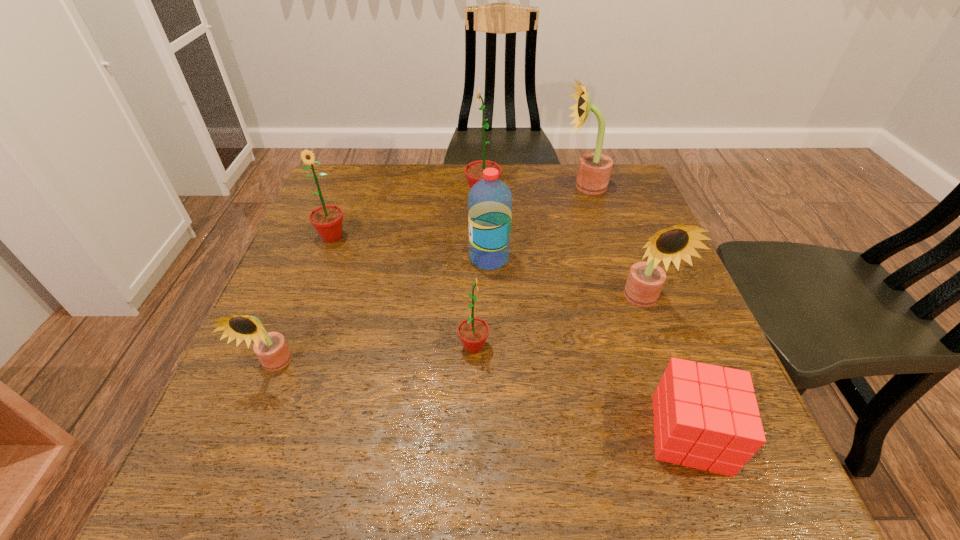
Locate an element on the screen. Image resolution: width=960 pixels, height=540 pixels. empty space that is in between the biggest green sunflower and the red cube is located at coordinates (587, 315).

I want to click on vacant space that is in between the shortest object and the red water bottle, so click(x=589, y=346).

In order to click on vacant region between the biggest yellow sunflower and the second biggest yellow sunflower in this screenshot , I will do `click(613, 244)`.

This screenshot has height=540, width=960. I want to click on vacant point located between the water bottle and the nearest object, so click(x=589, y=346).

Where is `vacant space in between the nearest yellow sunflower and the biggest green sunflower`? Image resolution: width=960 pixels, height=540 pixels. vacant space in between the nearest yellow sunflower and the biggest green sunflower is located at coordinates (379, 281).

Locate an element on the screen. The image size is (960, 540). free space between the water bottle and the smallest yellow sunflower is located at coordinates pyautogui.click(x=382, y=312).

Select which object appears as the sixth closest to the biggest yellow sunflower. Please provide its 2D coordinates. Your answer should be formatted as a tuple, i.e. [(x, y)], where the tuple contains the x and y coordinates of a point satisfying the conditions above.

[(705, 417)]

You are a GUI agent. You are given a task and a screenshot of the screen. Output one action in this format:
    pyautogui.click(x=<x>, y=<y>)
    Task: Click on the object that is the closest to the third nearest sunflower
    
    Given the screenshot: What is the action you would take?
    click(705, 417)

Locate which sunflower ranks third in proximity to the nearest green sunflower. Please provide its 2D coordinates. Your answer should be formatted as a tuple, i.e. [(x, y)], where the tuple contains the x and y coordinates of a point satisfying the conditions above.

[(327, 220)]

Identify the location of the third closest sunflower relative to the third farthest sunflower. (473, 332).